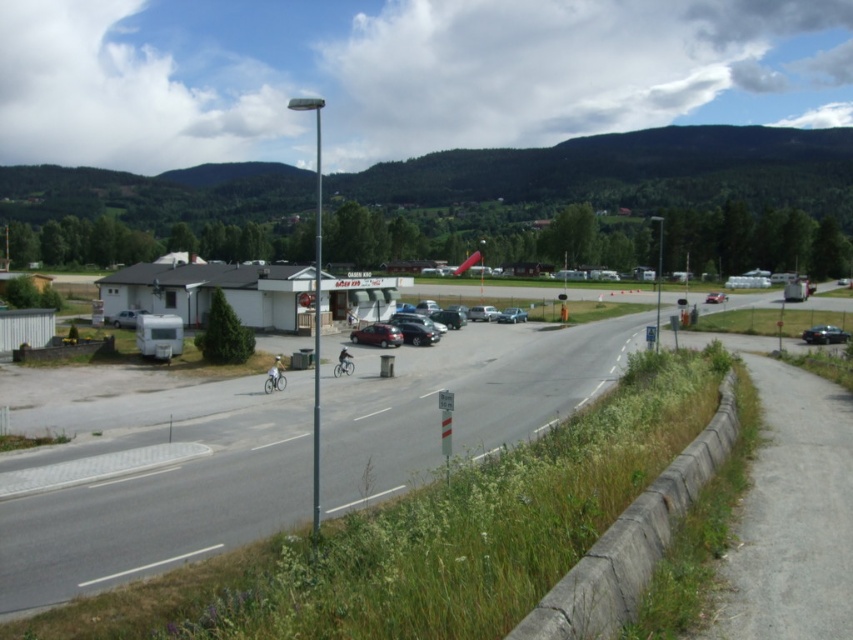
You are a delivery person who needs to choose between a white matte bicycle at center and a dark gray metallic motorcycle at center for a short trip. Considering their sizes, which vehicle would require more space to maneuver in tight areas?

The white matte bicycle at center is bigger than the dark gray metallic motorcycle at center, so it would require more space to maneuver in tight areas.

Looking at this image, you are driving a delivery van and need to pass through the area between the shiny black sedan at center and the satin silver sedan at center. Can your van, which is 2 meters wide, fit through the space between them?

The shiny black sedan at center is in front of the satin silver sedan at center, but there is no information provided about the width of the space between them. Therefore, it is impossible to determine if the van can fit through the space.

You are standing at the roadside in the scene and want to determine the relative positions of two points marked in the image. Which point, point 1 at coordinates point (434, 339) or point 2 at coordinates point (514, 320), is closer to you?

Point 1 at coordinates point (434, 339) is closer to you than point 2 at coordinates point (514, 320).